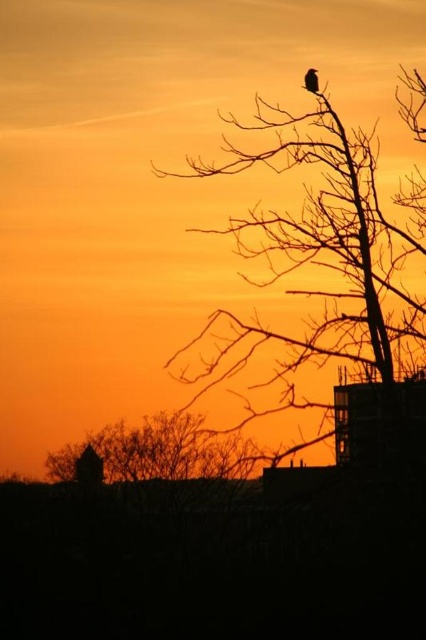
You are an ornithologist observing the sunset scene. You notice the silhouette bare tree at upper right and the silhouette feathered bird at upper center. Which object occupies a larger horizontal space in the image?

The silhouette bare tree at upper right might be wider than the silhouette feathered bird at upper center according to the description.

You are a photographer standing at the camera position. You want to capture a closeup shot of the silhouette bare tree at upper right. Given that your telephoto lens has a maximum zoom range of 100 meters, will you be able to achieve this?

The silhouette bare tree at upper right is 117.26 meters away from the camera. Since the telephoto lens can only zoom up to 100 meters, it will not be sufficient to capture a closeup of the silhouette bare tree at upper right.